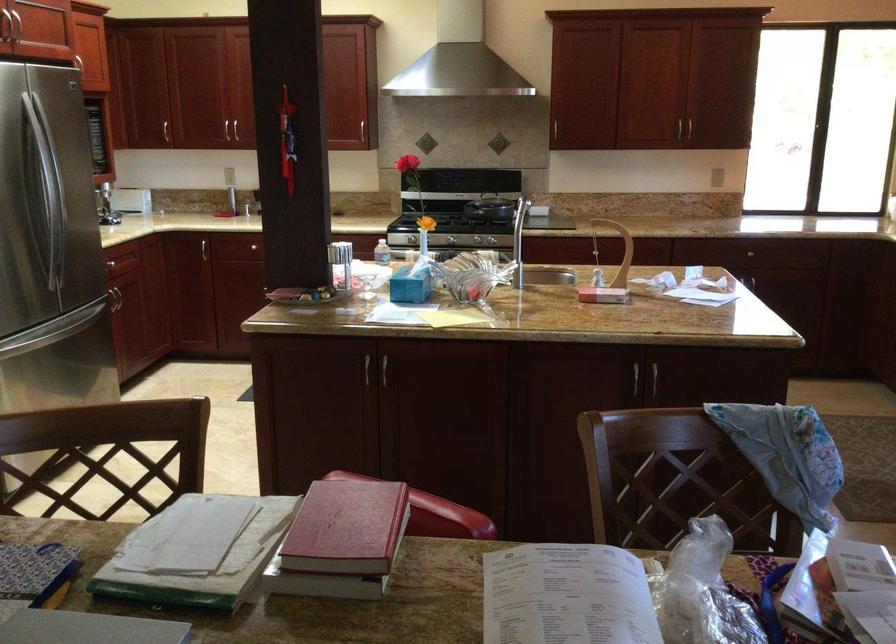
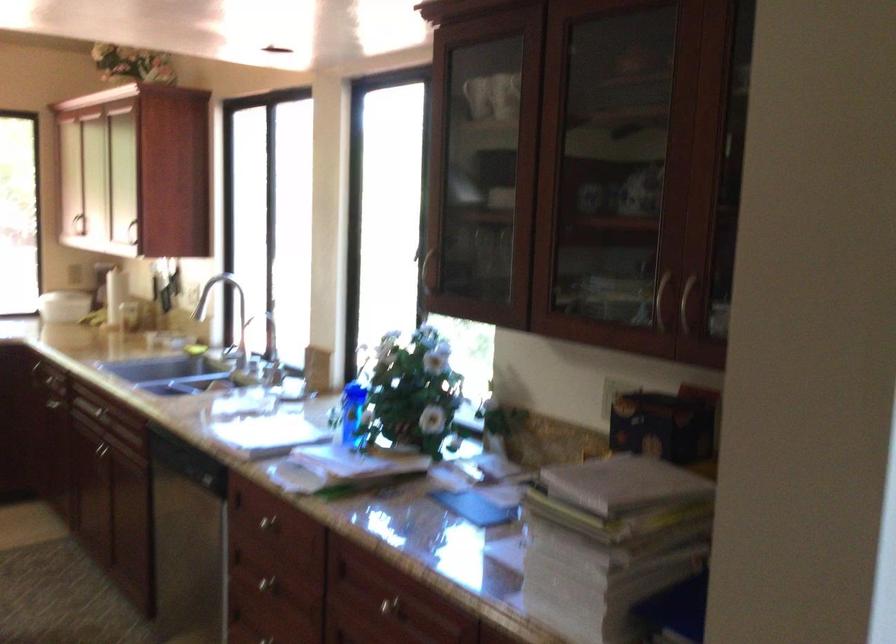
Question: The first image is from the beginning of the video and the second image is from the end. How did the camera likely rotate when shooting the video?

Choices:
 (A) Left
 (B) Right
 (C) Up
 (D) Down

Answer: (B)